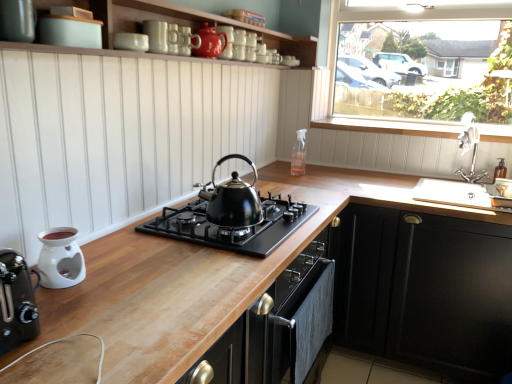
Where is `free space behind white glossy oil burner at lower left, the fourth appliance in the right-to-left sequence`? free space behind white glossy oil burner at lower left, the fourth appliance in the right-to-left sequence is located at coordinates (114, 253).